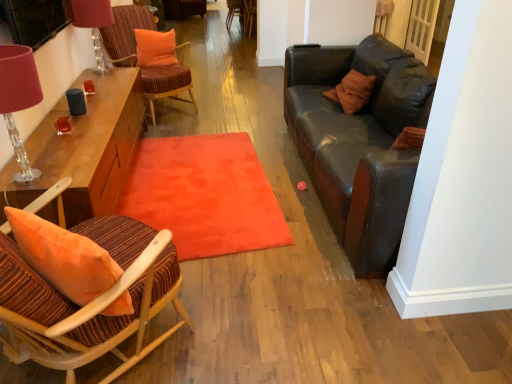
Question: Which direction should I rotate to look at wooden armchair at center, acting as the second armchair starting from the right?

Choices:
 (A) right
 (B) left

Answer: (B)

Question: Considering the relative sizes of striped fabric chair at left, the 3th chair when ordered from back to front, and wooden armchair at center, which is the 2th armchair from left to right, in the image provided, is striped fabric chair at left, the 3th chair when ordered from back to front, smaller than wooden armchair at center, which is the 2th armchair from left to right,?

Choices:
 (A) yes
 (B) no

Answer: (B)

Question: Is striped fabric chair at left, the 3th chair when ordered from back to front, at the left side of wooden armchair at center, positioned as the first armchair in right-to-left order?

Choices:
 (A) yes
 (B) no

Answer: (A)

Question: Does striped fabric chair at left, the 3th chair when ordered from back to front, have a greater width compared to wooden armchair at center, positioned as the first armchair in right-to-left order?

Choices:
 (A) yes
 (B) no

Answer: (B)

Question: Does striped fabric chair at left, the first chair positioned from the front, contain wooden armchair at center, positioned as the first armchair in right-to-left order?

Choices:
 (A) yes
 (B) no

Answer: (B)

Question: Is striped fabric chair at left, positioned as the third chair in top-to-bottom order, positioned far away from wooden armchair at center, positioned as the first armchair in right-to-left order?

Choices:
 (A) no
 (B) yes

Answer: (B)

Question: Considering the relative sizes of striped fabric chair at left, which ranks as the 1th chair in bottom-to-top order, and wooden armchair at center, which is the 2th armchair from left to right, in the image provided, is striped fabric chair at left, which ranks as the 1th chair in bottom-to-top order, taller than wooden armchair at center, which is the 2th armchair from left to right,?

Choices:
 (A) yes
 (B) no

Answer: (B)

Question: Can you confirm if striped fabric chair at left, the 3th chair when ordered from back to front, is taller than velvet orange chair at upper left, placed as the second chair when sorted from back to front?

Choices:
 (A) no
 (B) yes

Answer: (A)

Question: Would you say velvet orange chair at upper left, placed as the second chair when sorted from back to front, is part of striped fabric chair at left, positioned as the third chair in top-to-bottom order,'s contents?

Choices:
 (A) yes
 (B) no

Answer: (B)

Question: Is striped fabric chair at left, the 3th chair when ordered from back to front, facing away from velvet orange chair at upper left, positioned as the second chair in bottom-to-top order?

Choices:
 (A) yes
 (B) no

Answer: (B)

Question: Can you confirm if striped fabric chair at left, the first chair positioned from the front, is thinner than velvet orange chair at upper left, the second chair viewed from the top?

Choices:
 (A) no
 (B) yes

Answer: (B)

Question: Is striped fabric chair at left, which ranks as the 1th chair in bottom-to-top order, oriented towards velvet orange chair at upper left, placed as the second chair when sorted from back to front?

Choices:
 (A) yes
 (B) no

Answer: (B)

Question: Considering the relative sizes of striped fabric chair at left, the 3th chair when ordered from back to front, and velvet orange chair at upper left, placed as the second chair when sorted from back to front, in the image provided, is striped fabric chair at left, the 3th chair when ordered from back to front, bigger than velvet orange chair at upper left, placed as the second chair when sorted from back to front,?

Choices:
 (A) yes
 (B) no

Answer: (B)

Question: From the image's perspective, would you say wooden armchair at center, which is the 2th armchair from left to right, is positioned over wooden armchair at center, acting as the second armchair starting from the right?

Choices:
 (A) yes
 (B) no

Answer: (B)